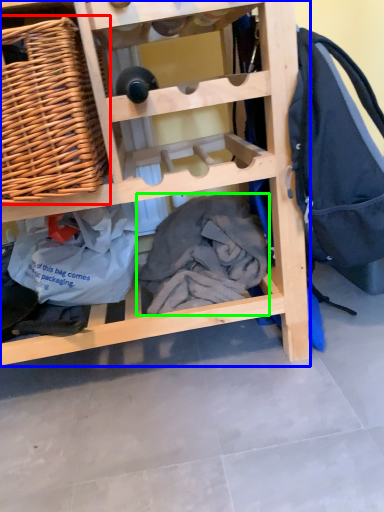
Question: Which is nearer to the picnic basket (highlighted by a red box)? furniture (highlighted by a blue box) or clothing (highlighted by a green box).

Choices:
 (A) furniture
 (B) clothing

Answer: (A)